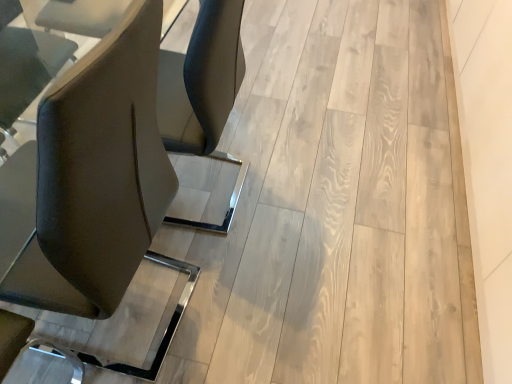
Describe the element at coordinates (352, 204) in the screenshot. This screenshot has width=512, height=384. I see `natural wood floor at center` at that location.

Locate an element on the screen. The height and width of the screenshot is (384, 512). natural wood floor at center is located at coordinates (352, 204).

At what (x,y) coordinates should I click in order to perform the action: click on matte black chair at left. Please return your answer as a coordinate pair (x, y). The width and height of the screenshot is (512, 384). Looking at the image, I should click on (95, 177).

The width and height of the screenshot is (512, 384). What do you see at coordinates (95, 177) in the screenshot?
I see `matte black chair at left` at bounding box center [95, 177].

Where is `natural wood floor at center`? The height and width of the screenshot is (384, 512). natural wood floor at center is located at coordinates (352, 204).

Is matte black chair at left to the left of natural wood floor at center from the viewer's perspective?

Yes, matte black chair at left is to the left of natural wood floor at center.

Which object is further away from the camera taking this photo, matte black chair at left or natural wood floor at center?

natural wood floor at center is more distant.

Considering the positions of point (94, 72) and point (455, 328), is point (94, 72) closer or farther from the camera than point (455, 328)?

Clearly, point (94, 72) is closer to the camera than point (455, 328).

From the image's perspective, does matte black chair at left appear higher than natural wood floor at center?

Actually, matte black chair at left appears below natural wood floor at center in the image.

From a real-world perspective, is matte black chair at left under natural wood floor at center?

Actually, matte black chair at left is physically above natural wood floor at center in the real world.

Looking at their sizes, would you say matte black chair at left is wider or thinner than natural wood floor at center?

Considering their sizes, matte black chair at left looks slimmer than natural wood floor at center.

Can you confirm if matte black chair at left is taller than natural wood floor at center?

Indeed, matte black chair at left has a greater height compared to natural wood floor at center.

Considering the sizes of objects matte black chair at left and natural wood floor at center in the image provided, who is bigger, matte black chair at left or natural wood floor at center?

With larger size is natural wood floor at center.

Is matte black chair at left surrounding natural wood floor at center?

No, natural wood floor at center is located outside of matte black chair at left.

Is matte black chair at left next to natural wood floor at center?

No, matte black chair at left is not beside natural wood floor at center.

Could you tell me if matte black chair at left is facing natural wood floor at center?

No, matte black chair at left is not turned towards natural wood floor at center.

How many degrees apart are the facing directions of matte black chair at left and natural wood floor at center?

The angular difference between matte black chair at left and natural wood floor at center is 94.8 degrees.

Locate an element on the screen. plywood above the matte black chair at left (from the image's perspective) is located at coordinates (352, 204).

Visually, is natural wood floor at center positioned to the left or to the right of matte black chair at left?

Clearly, natural wood floor at center is on the right of matte black chair at left in the image.

Considering the positions of objects natural wood floor at center and matte black chair at left in the image provided, who is behind, natural wood floor at center or matte black chair at left?

natural wood floor at center is behind.

Is point (375, 107) less distant than point (9, 296)?

No, it is not.

From the image's perspective, is natural wood floor at center above or below matte black chair at left?

Clearly, from the image's perspective, natural wood floor at center is above matte black chair at left.

From a real-world perspective, relative to matte black chair at left, is natural wood floor at center vertically above or below?

From a real-world perspective, natural wood floor at center is physically below matte black chair at left.

Between natural wood floor at center and matte black chair at left, which one has smaller width?

With smaller width is matte black chair at left.

Between natural wood floor at center and matte black chair at left, which one has less height?

Standing shorter between the two is natural wood floor at center.

Which of these two, natural wood floor at center or matte black chair at left, is bigger?

natural wood floor at center is bigger.

Is natural wood floor at center inside or outside of matte black chair at left?

natural wood floor at center is not enclosed by matte black chair at left.

Is natural wood floor at center in contact with matte black chair at left?

They are not placed beside each other.

Is natural wood floor at center looking in the opposite direction of matte black chair at left?

No, natural wood floor at center is not facing away from matte black chair at left.

What's the angular difference between natural wood floor at center and matte black chair at left's facing directions?

The facing directions of natural wood floor at center and matte black chair at left are 94.8 degrees apart.

Measure the distance from natural wood floor at center to matte black chair at left.

34.34 inches.

The image size is (512, 384). In order to click on chair in front of the natural wood floor at center in this screenshot , I will do `click(95, 177)`.

You are a GUI agent. You are given a task and a screenshot of the screen. Output one action in this format:
    pyautogui.click(x=<x>, y=<y>)
    Task: Click on the plywood beneath the matte black chair at left (from a real-world perspective)
    The height and width of the screenshot is (384, 512).
    Given the screenshot: What is the action you would take?
    pyautogui.click(x=352, y=204)

Image resolution: width=512 pixels, height=384 pixels. Find the location of `plywood on the right of matte black chair at left`. plywood on the right of matte black chair at left is located at coordinates (352, 204).